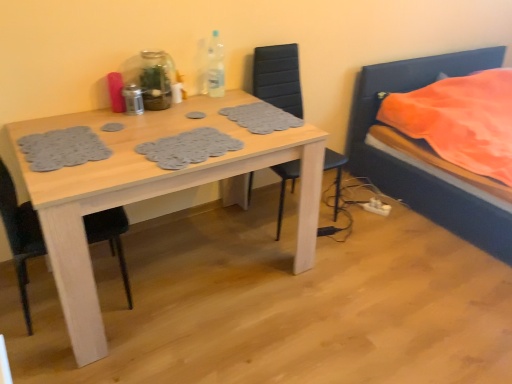
Where is `vacant area situated below light wood table at center (from a real-world perspective)`? The width and height of the screenshot is (512, 384). vacant area situated below light wood table at center (from a real-world perspective) is located at coordinates (199, 263).